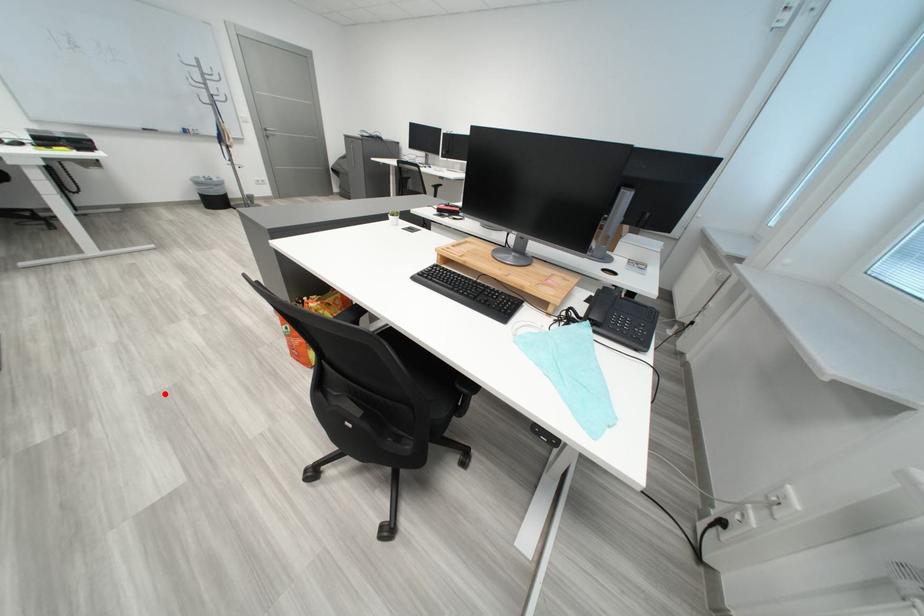
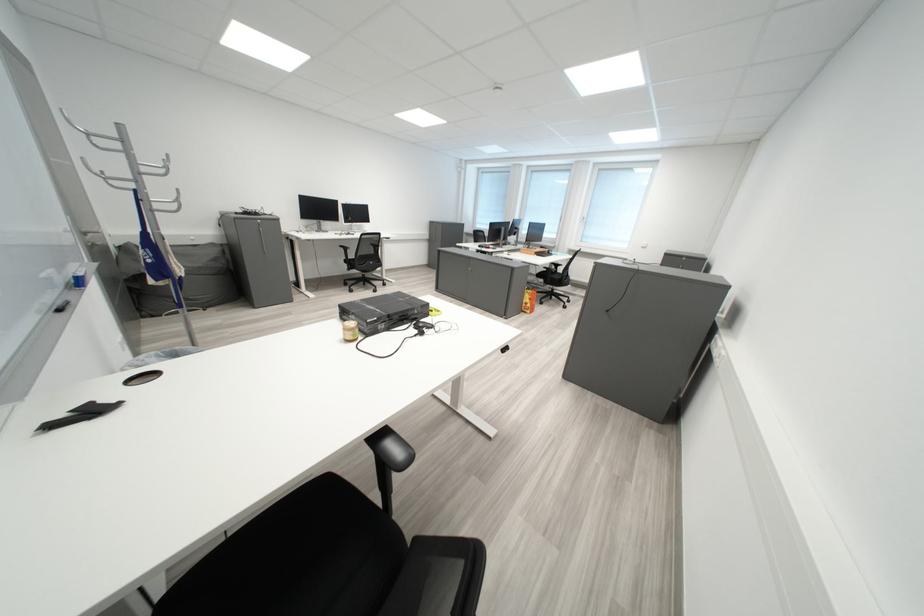
Find the pixel in the second image that matches the highlighted location in the first image.

(574, 333)